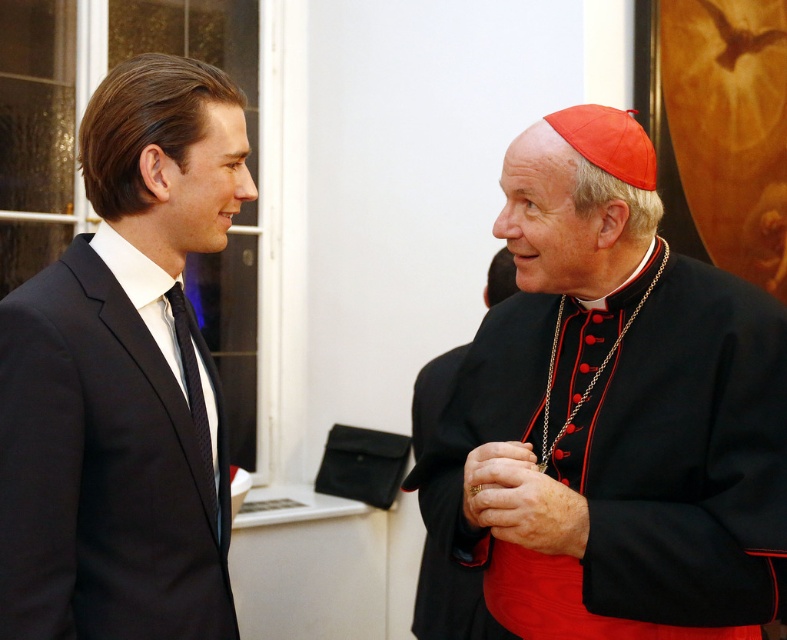
You are a photographer standing at the back of the room. You want to take a photo of both the black satin cassock at center and the matte black suit at left. Which one will appear larger in the photo?

The black satin cassock at center will appear larger in the photo because it is closer to the viewer than the matte black suit at left.

You are planning to hang both the black satin cassock at center and the matte black suit at left on a standard closet rod. Considering their heights, which one is shorter and might need a shorter hanger?

The black satin cassock at center is shorter than the matte black suit at left, so it might need a shorter hanger.

You are a photographer standing at the camera position. You want to take a closeup photo of the black satin cassock at center. Considering the distance between you and the cassock, is it possible to capture the cassock in focus without moving closer?

The distance between the black satin cassock at center and the camera is 4.47 feet. Since this distance is manageable for a closeup shot with proper focus, the photographer can capture the cassock in focus without needing to move closer.